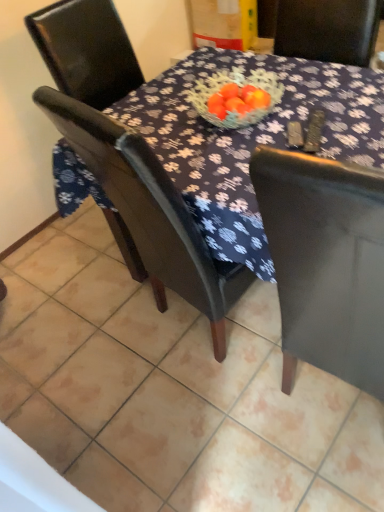
Question: Does matte black chair at center, marked as the 1th chair in a bottom-to-top arrangement, turn towards matte black chair at center?

Choices:
 (A) no
 (B) yes

Answer: (B)

Question: Considering the relative sizes of matte black chair at center, the second chair when ordered from top to bottom, and matte black chair at center in the image provided, is matte black chair at center, the second chair when ordered from top to bottom, shorter than matte black chair at center?

Choices:
 (A) yes
 (B) no

Answer: (B)

Question: Can you confirm if matte black chair at center, marked as the 1th chair in a bottom-to-top arrangement, is wider than matte black chair at center?

Choices:
 (A) no
 (B) yes

Answer: (A)

Question: Considering the relative sizes of matte black chair at center, marked as the 1th chair in a bottom-to-top arrangement, and matte black chair at center in the image provided, is matte black chair at center, marked as the 1th chair in a bottom-to-top arrangement, smaller than matte black chair at center?

Choices:
 (A) yes
 (B) no

Answer: (A)

Question: Does matte black chair at center, marked as the 1th chair in a bottom-to-top arrangement, come in front of matte black chair at center?

Choices:
 (A) yes
 (B) no

Answer: (A)

Question: Is matte black chair at center, marked as the 1th chair in a bottom-to-top arrangement, turned away from matte black chair at center?

Choices:
 (A) yes
 (B) no

Answer: (B)

Question: Is matte black chair at center aimed at matte black chair at center, the second chair when ordered from top to bottom?

Choices:
 (A) yes
 (B) no

Answer: (B)

Question: Can you confirm if matte black chair at center is positioned to the left of matte black chair at center, the second chair when ordered from top to bottom?

Choices:
 (A) no
 (B) yes

Answer: (A)

Question: Does matte black chair at center have a smaller size compared to matte black chair at center, marked as the 1th chair in a bottom-to-top arrangement?

Choices:
 (A) no
 (B) yes

Answer: (A)

Question: Is matte black chair at center positioned before matte black chair at center, marked as the 1th chair in a bottom-to-top arrangement?

Choices:
 (A) yes
 (B) no

Answer: (B)

Question: Does matte black chair at center have a greater width compared to matte black chair at center, the second chair when ordered from top to bottom?

Choices:
 (A) no
 (B) yes

Answer: (B)

Question: From a real-world perspective, is matte black chair at center physically above matte black chair at center, the second chair when ordered from top to bottom?

Choices:
 (A) no
 (B) yes

Answer: (A)

Question: Considering the relative sizes of matte black chair at left, the 2th chair in the bottom-to-top sequence, and matte black chair at center in the image provided, is matte black chair at left, the 2th chair in the bottom-to-top sequence, shorter than matte black chair at center?

Choices:
 (A) no
 (B) yes

Answer: (A)